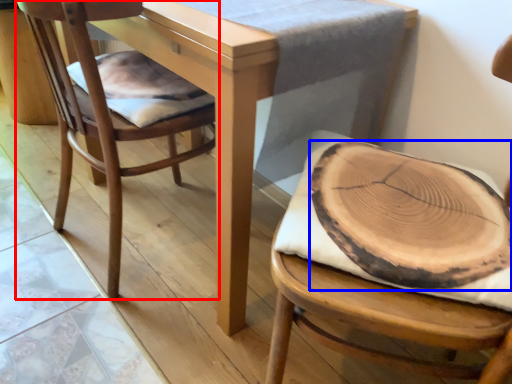
Question: Which object appears closest to the camera in this image, chair (highlighted by a red box) or food (highlighted by a blue box)?

Choices:
 (A) chair
 (B) food

Answer: (B)